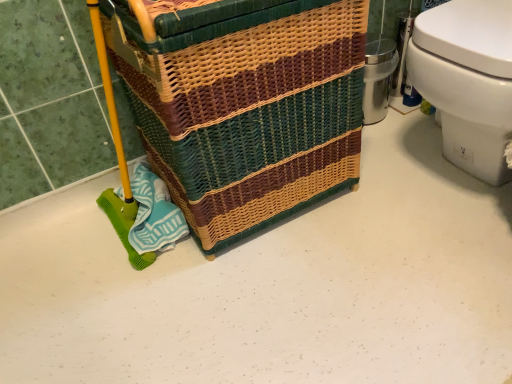
Question: Does woven wicker basket at center lie in front of white glossy toilet at right?

Choices:
 (A) yes
 (B) no

Answer: (A)

Question: Is woven wicker basket at center behind white glossy toilet at right?

Choices:
 (A) yes
 (B) no

Answer: (B)

Question: From a real-world perspective, is woven wicker basket at center physically above white glossy toilet at right?

Choices:
 (A) yes
 (B) no

Answer: (A)

Question: From the image's perspective, is woven wicker basket at center over white glossy toilet at right?

Choices:
 (A) yes
 (B) no

Answer: (B)

Question: Does woven wicker basket at center have a lesser height compared to white glossy toilet at right?

Choices:
 (A) no
 (B) yes

Answer: (A)

Question: Is woven wicker basket at center positioned with its back to white glossy toilet at right?

Choices:
 (A) yes
 (B) no

Answer: (B)

Question: Is woven wicker basket at center a part of white glossy toilet at right?

Choices:
 (A) no
 (B) yes

Answer: (A)

Question: Does white glossy toilet at right have a smaller size compared to woven wicker basket at center?

Choices:
 (A) yes
 (B) no

Answer: (A)

Question: Is white glossy toilet at right bigger than woven wicker basket at center?

Choices:
 (A) no
 (B) yes

Answer: (A)

Question: Is white glossy toilet at right beside woven wicker basket at center?

Choices:
 (A) yes
 (B) no

Answer: (B)

Question: Is the position of white glossy toilet at right less distant than that of woven wicker basket at center?

Choices:
 (A) yes
 (B) no

Answer: (B)

Question: From a real-world perspective, is white glossy toilet at right under woven wicker basket at center?

Choices:
 (A) no
 (B) yes

Answer: (B)

Question: Looking at the image, does white glossy toilet at right seem bigger or smaller compared to woven wicker basket at center?

Choices:
 (A) big
 (B) small

Answer: (B)